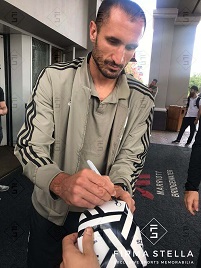
Locate an element on the screen. Image resolution: width=201 pixels, height=268 pixels. carpet is located at coordinates (112, 233), (166, 160).